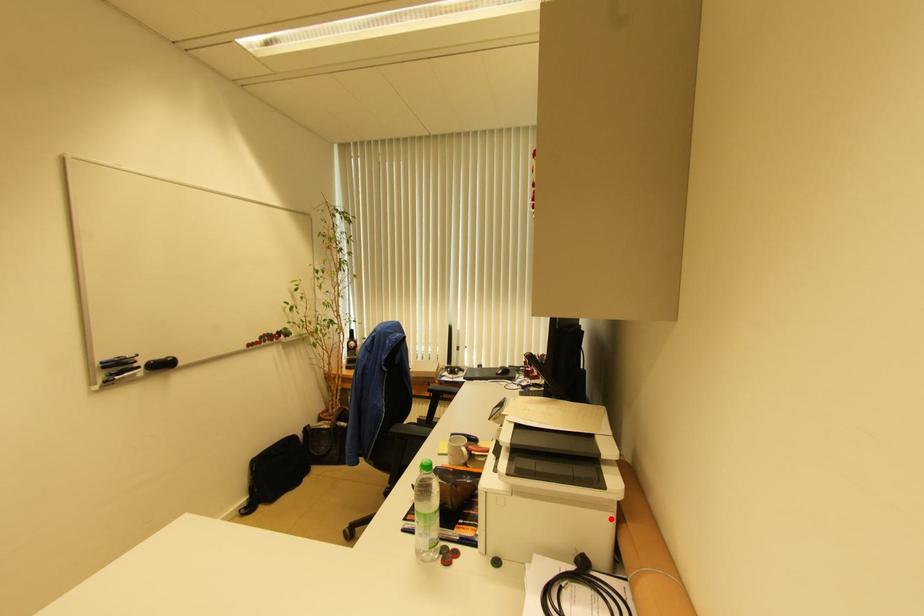
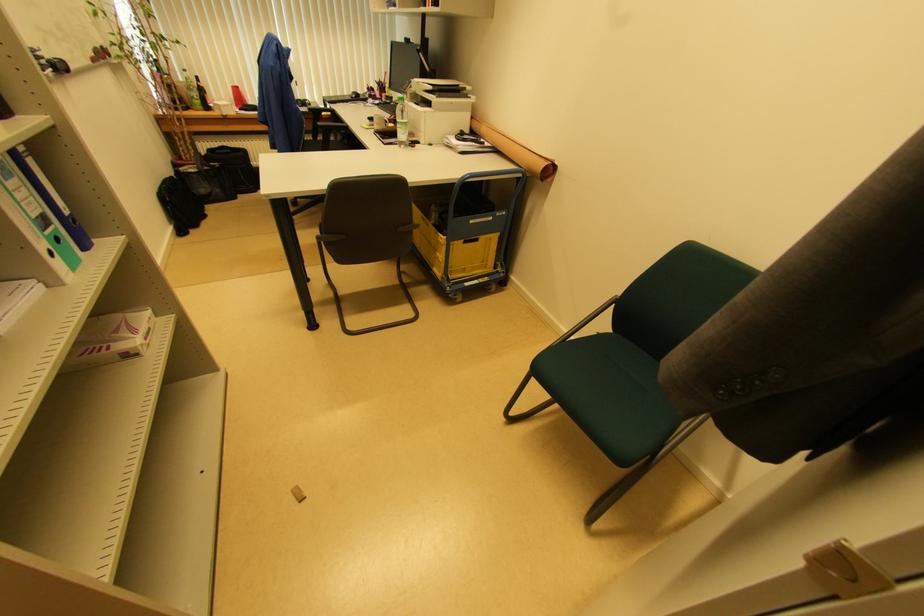
Question: I am providing you with two images of the same scene from different viewpoints. A red point is marked on the first image. Is the red point's position out of view in image 2?

Choices:
 (A) Yes
 (B) No

Answer: (B)